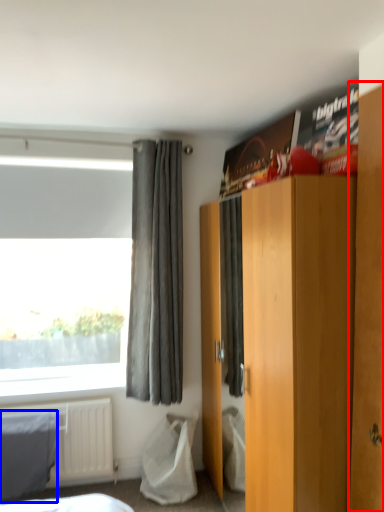
Question: Among these objects, which one is nearest to the camera, armoire (highlighted by a red box) or blanket (highlighted by a blue box)?

Choices:
 (A) armoire
 (B) blanket

Answer: (A)